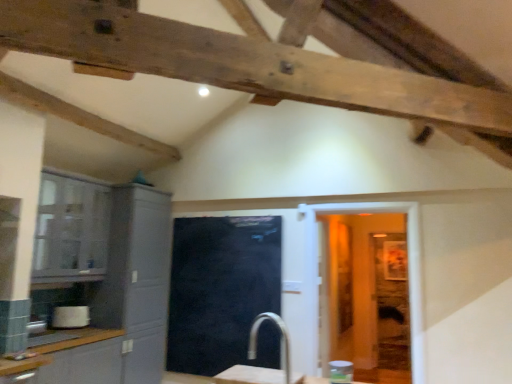
Where is `black glass door at center`? Image resolution: width=512 pixels, height=384 pixels. black glass door at center is located at coordinates (223, 292).

At what (x,y) coordinates should I click in order to perform the action: click on clear plastic jar at lower right, the first appliance when ordered from front to back. Please return your answer as a coordinate pair (x, y). The image size is (512, 384). Looking at the image, I should click on (341, 372).

How much space does clear plastic jar at lower right, placed as the 2th appliance when sorted from left to right, occupy horizontally?

clear plastic jar at lower right, placed as the 2th appliance when sorted from left to right, is 5.22 inches in width.

At what (x,y) coordinates should I click in order to perform the action: click on white glossy toaster at lower left, marked as the second appliance in a top-to-bottom arrangement. Please return your answer as a coordinate pair (x, y). Looking at the image, I should click on click(x=70, y=317).

From a real-world perspective, is matte gray cabinet at lower left, the third cabinetry when ordered from back to front, located higher than black glass door at center?

Incorrect, from a real-world perspective, matte gray cabinet at lower left, the third cabinetry when ordered from back to front, is lower than black glass door at center.

Considering the positions of objects matte gray cabinet at lower left, the third cabinetry when ordered from back to front, and black glass door at center in the image provided, who is more to the left, matte gray cabinet at lower left, the third cabinetry when ordered from back to front, or black glass door at center?

matte gray cabinet at lower left, the third cabinetry when ordered from back to front, is more to the left.

From the image's perspective, is matte gray cabinet at lower left, the third cabinetry when ordered from back to front, beneath black glass door at center?

Yes, from the image's perspective, matte gray cabinet at lower left, the third cabinetry when ordered from back to front, is beneath black glass door at center.

Is matte gray cabinet at left, positioned as the first cabinetry in back-to-front order, a part of white glossy door at center?

No, white glossy door at center does not contain matte gray cabinet at left, positioned as the first cabinetry in back-to-front order.

Image resolution: width=512 pixels, height=384 pixels. I want to click on the 1st cabinetry directly beneath the white glossy door at center (from a real-world perspective), so click(x=116, y=299).

From a real-world perspective, between white glossy door at center and matte gray cabinet at left, positioned as the first cabinetry in back-to-front order, who is vertically lower?

From a 3D spatial view, matte gray cabinet at left, positioned as the first cabinetry in back-to-front order, is below.

From the image's perspective, would you say black glass door at center is shown under matte gray cabinet at left, which is counted as the second cabinetry, starting from the front?

Yes.

Which point is more distant from viewer, (201, 363) or (64, 215)?

The point (201, 363) is behind.

Between black glass door at center and matte gray cabinet at left, the second cabinetry positioned from the back, which one appears on the right side from the viewer's perspective?

From the viewer's perspective, black glass door at center appears more on the right side.

Does black glass door at center have a lesser height compared to matte gray cabinet at left, which is counted as the second cabinetry, starting from the front?

No.

Is white glossy toaster at lower left, marked as the second appliance in a top-to-bottom arrangement, facing away from matte gray cabinet at lower left, the third cabinetry when ordered from back to front?

No, white glossy toaster at lower left, marked as the second appliance in a top-to-bottom arrangement,'s orientation is not away from matte gray cabinet at lower left, the third cabinetry when ordered from back to front.

From the image's perspective, is white glossy toaster at lower left, marked as the second appliance in a top-to-bottom arrangement, positioned above or below matte gray cabinet at lower left, the 1th cabinetry positioned from the front?

Clearly, from the image's perspective, white glossy toaster at lower left, marked as the second appliance in a top-to-bottom arrangement, is above matte gray cabinet at lower left, the 1th cabinetry positioned from the front.

Does white glossy toaster at lower left, which appears as the second appliance when viewed from the front, come behind matte gray cabinet at lower left, the 1th cabinetry positioned from the front?

Yes, the depth of white glossy toaster at lower left, which appears as the second appliance when viewed from the front, is greater than that of matte gray cabinet at lower left, the 1th cabinetry positioned from the front.

Considering the sizes of objects white glossy toaster at lower left, arranged as the first appliance when viewed from the back, and matte gray cabinet at lower left, the 1th cabinetry positioned from the front, in the image provided, who is taller, white glossy toaster at lower left, arranged as the first appliance when viewed from the back, or matte gray cabinet at lower left, the 1th cabinetry positioned from the front,?

matte gray cabinet at lower left, the 1th cabinetry positioned from the front.

Based on the photo, is clear plastic jar at lower right, the first appliance in the top-to-bottom sequence, to the right of white marble table at center from the viewer's perspective?

Correct, you'll find clear plastic jar at lower right, the first appliance in the top-to-bottom sequence, to the right of white marble table at center.

Choose the correct answer: Is clear plastic jar at lower right, arranged as the 2th appliance when ordered from the bottom, inside white marble table at center or outside it?

clear plastic jar at lower right, arranged as the 2th appliance when ordered from the bottom, is not enclosed by white marble table at center.

Is clear plastic jar at lower right, arranged as the 2th appliance when ordered from the bottom, looking in the opposite direction of white marble table at center?

That's right, clear plastic jar at lower right, arranged as the 2th appliance when ordered from the bottom, is facing away from white marble table at center.

Does white marble table at center have a larger size compared to matte gray cabinet at lower left, the 1th cabinetry positioned from the front?

No.

Identify the location of cabinetry that is the 2nd one when counting leftward from the white marble table at center. (105, 357).

Can you confirm if white marble table at center is thinner than matte gray cabinet at lower left, the third cabinetry when ordered from back to front?

Indeed, white marble table at center has a lesser width compared to matte gray cabinet at lower left, the third cabinetry when ordered from back to front.

Which is nearer, (298, 374) or (50, 379)?

Point (298, 374) is farther from the camera than point (50, 379).

Measure the distance from matte gray cabinet at left, acting as the third cabinetry starting from the front, to white glossy toaster at lower left, which appears as the second appliance when viewed from the front.

matte gray cabinet at left, acting as the third cabinetry starting from the front, is 21.74 inches from white glossy toaster at lower left, which appears as the second appliance when viewed from the front.

There is a white glossy toaster at lower left, the 1th appliance in the bottom-to-top sequence. Identify the location of the 1st cabinetry above it (from a real-world perspective). (116, 299).

Is matte gray cabinet at left, positioned as the first cabinetry in back-to-front order, not within white glossy toaster at lower left, acting as the 2th appliance starting from the right?

matte gray cabinet at left, positioned as the first cabinetry in back-to-front order, is positioned outside white glossy toaster at lower left, acting as the 2th appliance starting from the right.

Is matte gray cabinet at left, positioned as the first cabinetry in back-to-front order, far away from white glossy toaster at lower left, which appears as the second appliance when viewed from the front?

No, there isn't a large distance between matte gray cabinet at left, positioned as the first cabinetry in back-to-front order, and white glossy toaster at lower left, which appears as the second appliance when viewed from the front.

This screenshot has width=512, height=384. I want to click on glass door lying on the right of matte gray cabinet at lower left, the third cabinetry when ordered from back to front, so click(223, 292).

Which cabinetry is the 1st one when counting from the left side of the white glossy door at center? Please provide its 2D coordinates.

[(116, 299)]

Based on their spatial positions, is matte gray cabinet at left, which is counted as the second cabinetry, starting from the front, or clear plastic jar at lower right, placed as the 2th appliance when sorted from left to right, closer to white glossy toaster at lower left, marked as the second appliance in a top-to-bottom arrangement?

Based on the image, matte gray cabinet at left, which is counted as the second cabinetry, starting from the front, appears to be nearer to white glossy toaster at lower left, marked as the second appliance in a top-to-bottom arrangement.

From the image, which object appears to be farther from black glass door at center, clear plastic jar at lower right, placed as the 2th appliance when sorted from left to right, or matte gray cabinet at left, the second cabinetry positioned from the back?

Based on the image, clear plastic jar at lower right, placed as the 2th appliance when sorted from left to right, appears to be further to black glass door at center.

When comparing their distances from white glossy toaster at lower left, acting as the 2th appliance starting from the right, does black glass door at center or matte gray cabinet at left, which is counted as the second cabinetry, starting from the front, seem closer?

Among the two, matte gray cabinet at left, which is counted as the second cabinetry, starting from the front, is located nearer to white glossy toaster at lower left, acting as the 2th appliance starting from the right.

When comparing their distances from clear plastic jar at lower right, arranged as the 2th appliance when ordered from the bottom, does matte gray cabinet at left, which is counted as the second cabinetry, starting from the front, or black glass door at center seem further?

matte gray cabinet at left, which is counted as the second cabinetry, starting from the front, is further to clear plastic jar at lower right, arranged as the 2th appliance when ordered from the bottom.

Looking at the image, which one is located further to matte gray cabinet at left, which is counted as the second cabinetry, starting from the front, white marble table at center or white glossy toaster at lower left, which appears as the second appliance when viewed from the front?

white marble table at center lies further to matte gray cabinet at left, which is counted as the second cabinetry, starting from the front, than the other object.

When comparing their distances from clear plastic jar at lower right, the first appliance in the top-to-bottom sequence, does matte gray cabinet at left, positioned as the first cabinetry in back-to-front order, or matte gray cabinet at left, the second cabinetry positioned from the back, seem closer?

matte gray cabinet at left, positioned as the first cabinetry in back-to-front order.

Estimate the real-world distances between objects in this image. Which object is closer to white marble table at center, white glossy door at center or white glossy toaster at lower left, acting as the 2th appliance starting from the right?

white glossy door at center lies closer to white marble table at center than the other object.

From the image, which object appears to be nearer to matte gray cabinet at left, positioned as the first cabinetry in back-to-front order, matte gray cabinet at left, which is counted as the second cabinetry, starting from the front, or matte gray cabinet at lower left, the 1th cabinetry positioned from the front?

matte gray cabinet at lower left, the 1th cabinetry positioned from the front.

At what (x,y) coordinates should I click in order to perform the action: click on glass door located between white glossy toaster at lower left, which appears as the second appliance when viewed from the front, and clear plastic jar at lower right, the first appliance when ordered from front to back, in the left-right direction. Please return your answer as a coordinate pair (x, y). The image size is (512, 384). Looking at the image, I should click on (223, 292).

At what (x,y) coordinates should I click in order to perform the action: click on table situated between matte gray cabinet at left, acting as the third cabinetry starting from the front, and clear plastic jar at lower right, arranged as the 2th appliance when ordered from the bottom, from left to right. Please return your answer as a coordinate pair (x, y). The image size is (512, 384). Looking at the image, I should click on (256, 376).

Where is `glass door located between matte gray cabinet at lower left, the 1th cabinetry positioned from the front, and white glossy door at center in the left-right direction`? The width and height of the screenshot is (512, 384). glass door located between matte gray cabinet at lower left, the 1th cabinetry positioned from the front, and white glossy door at center in the left-right direction is located at coordinates [223, 292].

The height and width of the screenshot is (384, 512). I want to click on cabinetry between matte gray cabinet at lower left, the third cabinetry when ordered from back to front, and white glossy door at center, so click(116, 299).